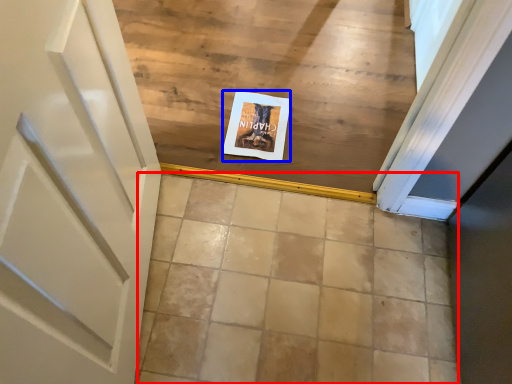
Question: Among these objects, which one is farthest to the camera, ceramic tile (highlighted by a red box) or postcard (highlighted by a blue box)?

Choices:
 (A) ceramic tile
 (B) postcard

Answer: (B)